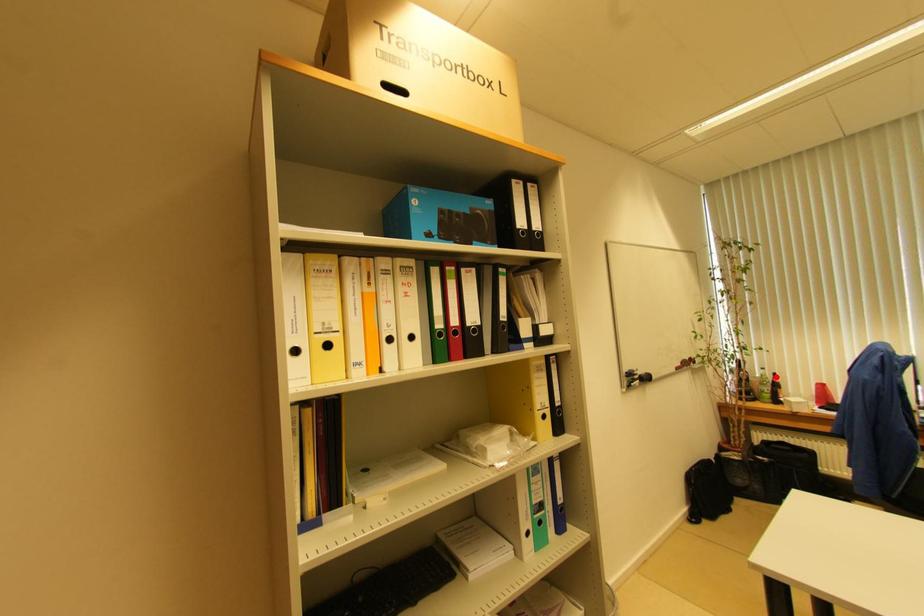
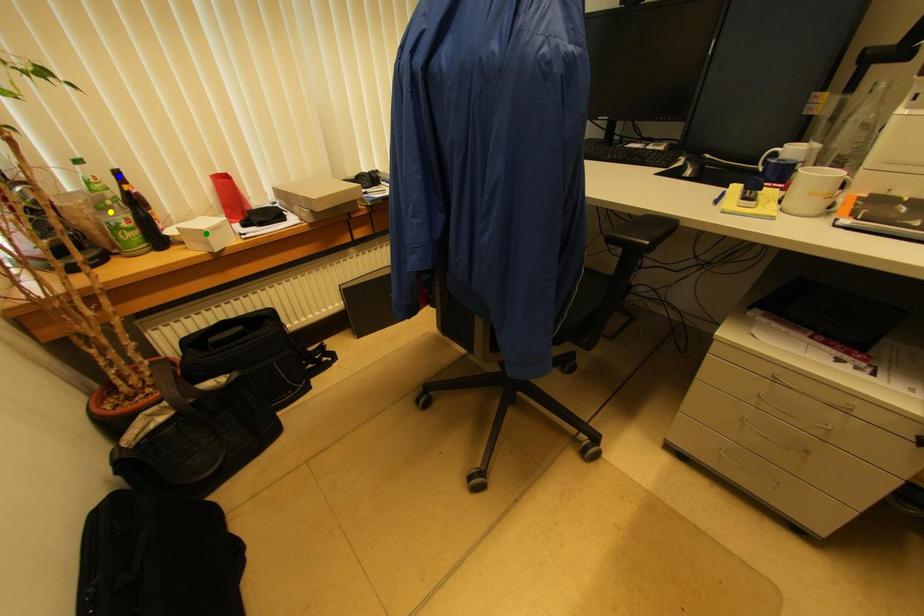
Question: I am providing you with two images of the same scene from different viewpoints. A red point is marked on the first image. You are given multiple points on the second image. Which spot in image 2 lines up with the point in image 1?

Choices:
 (A) yellow point
 (B) blue point
 (C) green point

Answer: (B)